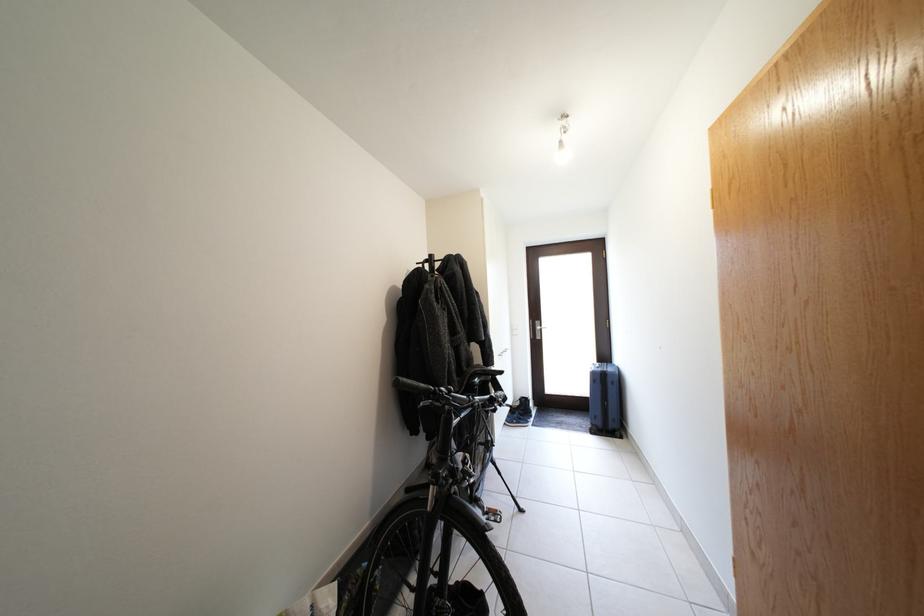
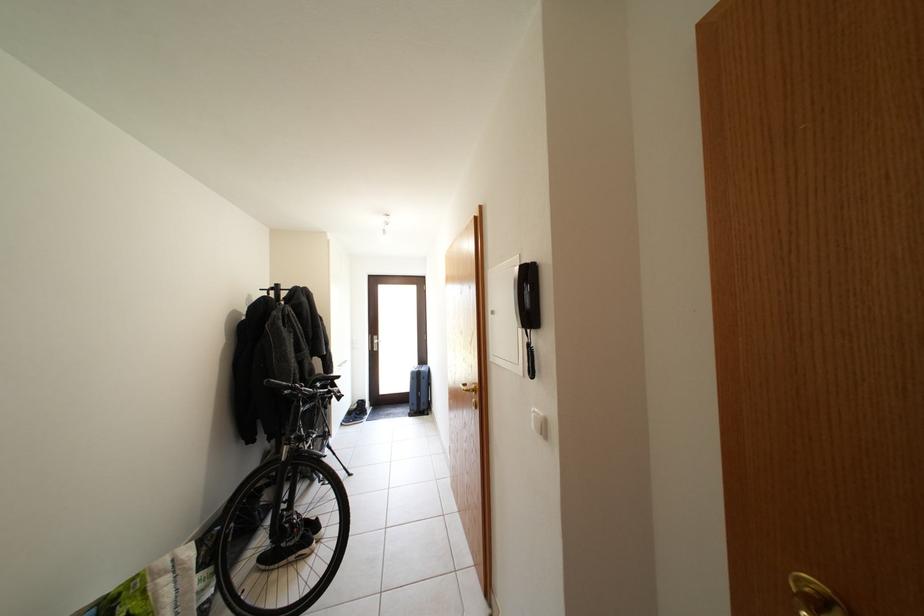
Locate, in the second image, the point that corresponds to (x=434, y=267) in the first image.

(281, 294)